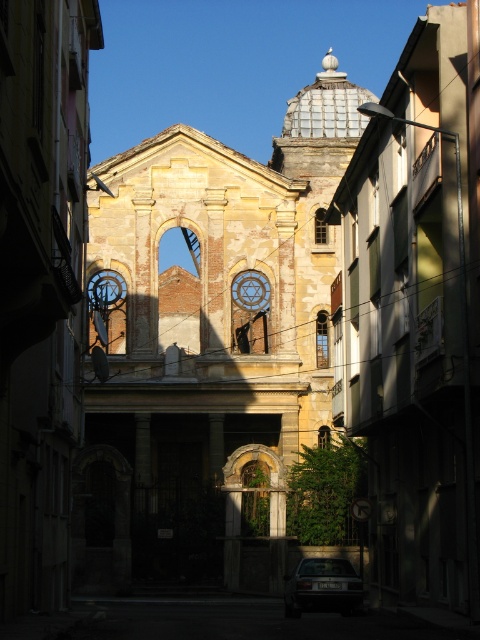
Question: Can you confirm if yellow stone church at center is positioned to the left of dark gray metallic car at lower center?

Choices:
 (A) yes
 (B) no

Answer: (A)

Question: Considering the relative positions of yellow stone church at center and dark gray metallic car at lower center in the image provided, where is yellow stone church at center located with respect to dark gray metallic car at lower center?

Choices:
 (A) right
 (B) left

Answer: (B)

Question: Is yellow stone church at center positioned before dark gray metallic car at lower center?

Choices:
 (A) no
 (B) yes

Answer: (A)

Question: Which object is closer to the camera taking this photo?

Choices:
 (A) yellow stone church at center
 (B) dark gray metallic car at lower center

Answer: (B)

Question: Which object is farther from the camera taking this photo?

Choices:
 (A) dark gray metallic car at lower center
 (B) yellow stone church at center

Answer: (B)